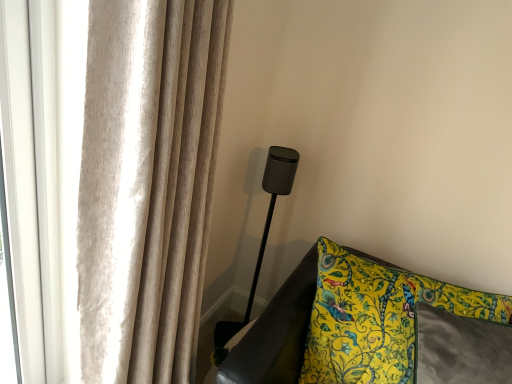
Question: Does yellow floral fabric cushion at lower right have a lesser height compared to matte black speaker at center?

Choices:
 (A) yes
 (B) no

Answer: (A)

Question: Is yellow floral fabric cushion at lower right facing towards matte black speaker at center?

Choices:
 (A) yes
 (B) no

Answer: (B)

Question: Can you confirm if yellow floral fabric cushion at lower right is positioned to the left of matte black speaker at center?

Choices:
 (A) no
 (B) yes

Answer: (A)

Question: Is yellow floral fabric cushion at lower right positioned with its back to matte black speaker at center?

Choices:
 (A) yes
 (B) no

Answer: (A)

Question: Is yellow floral fabric cushion at lower right located outside matte black speaker at center?

Choices:
 (A) yes
 (B) no

Answer: (A)

Question: Does yellow floral fabric cushion at lower right come behind matte black speaker at center?

Choices:
 (A) no
 (B) yes

Answer: (A)

Question: Does yellow floral fabric cushion at lower right have a lesser width compared to beige textured curtain at upper left?

Choices:
 (A) yes
 (B) no

Answer: (A)

Question: Is yellow floral fabric cushion at lower right to the right of beige textured curtain at upper left from the viewer's perspective?

Choices:
 (A) no
 (B) yes

Answer: (B)

Question: Can you confirm if yellow floral fabric cushion at lower right is shorter than beige textured curtain at upper left?

Choices:
 (A) no
 (B) yes

Answer: (B)

Question: Is beige textured curtain at upper left surrounded by yellow floral fabric cushion at lower right?

Choices:
 (A) no
 (B) yes

Answer: (A)

Question: Does yellow floral fabric cushion at lower right have a larger size compared to beige textured curtain at upper left?

Choices:
 (A) yes
 (B) no

Answer: (B)

Question: From a real-world perspective, is yellow floral fabric cushion at lower right positioned over beige textured curtain at upper left based on gravity?

Choices:
 (A) no
 (B) yes

Answer: (A)

Question: Is beige textured curtain at upper left shorter than matte black speaker at center?

Choices:
 (A) yes
 (B) no

Answer: (B)